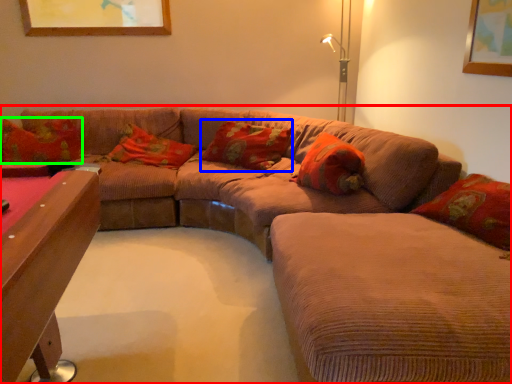
Question: Which is farther away from studio couch (highlighted by a red box)? pillow (highlighted by a blue box) or pillow (highlighted by a green box)?

Choices:
 (A) pillow
 (B) pillow

Answer: (B)